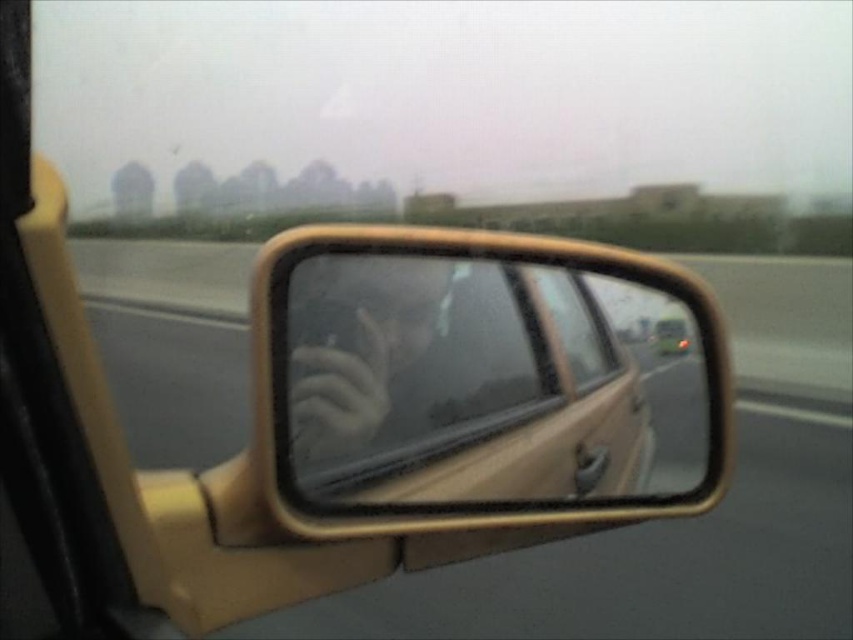
You are a driver who wants to ensure the frosted glass hand at center is visible in the rearview mirror. Based on the mirror reflection, is the hand positioned correctly to be seen in the mirror?

The frosted glass hand at center is positioned at point (357, 348) in the mirror reflection, which is within the visible area of the mirror. Therefore, the hand is correctly positioned to be seen in the rearview mirror.

You are a driver checking your side mirror and notice the matte yellow mirror at center and the frosted glass hand at center in the reflection. Which object appears wider in the mirror?

The matte yellow mirror at center appears wider than the frosted glass hand at center in the mirror.

You are a passenger in a car with a matte yellow mirror at center and a frosted glass hand at center in your view. You want to know which object takes up more space in your field of view. Which one is larger?

The matte yellow mirror at center is bigger than the frosted glass hand at center, so the matte yellow mirror at center takes up more space in your field of view.